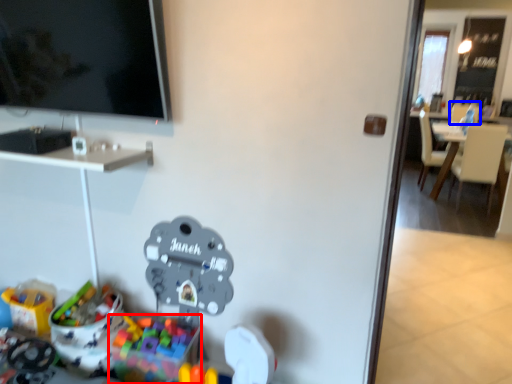
Question: Among these objects, which one is nearest to the camera, toy (highlighted by a red box) or armchair (highlighted by a blue box)?

Choices:
 (A) toy
 (B) armchair

Answer: (A)